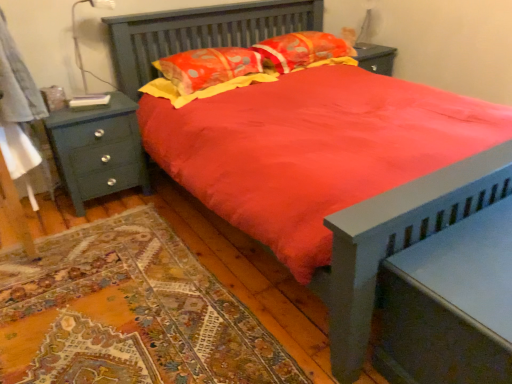
Question: Considering the relative sizes of metallic gray table lamp at upper left and floral fabric pillow at upper center, which is the 1th pillow in right-to-left order, in the image provided, is metallic gray table lamp at upper left bigger than floral fabric pillow at upper center, which is the 1th pillow in right-to-left order,?

Choices:
 (A) no
 (B) yes

Answer: (A)

Question: Is metallic gray table lamp at upper left far away from floral fabric pillow at upper center, which is the second pillow from left to right?

Choices:
 (A) yes
 (B) no

Answer: (A)

Question: Does metallic gray table lamp at upper left appear on the right side of floral fabric pillow at upper center, which is the 1th pillow in right-to-left order?

Choices:
 (A) no
 (B) yes

Answer: (A)

Question: Can you confirm if metallic gray table lamp at upper left is thinner than floral fabric pillow at upper center, which is the 1th pillow in right-to-left order?

Choices:
 (A) no
 (B) yes

Answer: (B)

Question: Is metallic gray table lamp at upper left completely or partially outside of floral fabric pillow at upper center, which is the second pillow from left to right?

Choices:
 (A) yes
 (B) no

Answer: (A)

Question: Can you confirm if metallic gray table lamp at upper left is taller than floral fabric pillow at upper center, which is the second pillow from left to right?

Choices:
 (A) yes
 (B) no

Answer: (A)

Question: Is teal wood nightstand at left, which appears as the first nightstand when viewed from the top, thinner than quilted orange pillow at center, positioned as the first pillow in left-to-right order?

Choices:
 (A) no
 (B) yes

Answer: (B)

Question: Considering the relative sizes of teal wood nightstand at left, which appears as the first nightstand when viewed from the top, and quilted orange pillow at center, positioned as the first pillow in left-to-right order, in the image provided, is teal wood nightstand at left, which appears as the first nightstand when viewed from the top, wider than quilted orange pillow at center, positioned as the first pillow in left-to-right order,?

Choices:
 (A) yes
 (B) no

Answer: (B)

Question: Does teal wood nightstand at left, arranged as the 2th nightstand when viewed from the right, have a greater height compared to quilted orange pillow at center, positioned as the first pillow in left-to-right order?

Choices:
 (A) yes
 (B) no

Answer: (A)

Question: Is teal wood nightstand at left, arranged as the 2th nightstand when viewed from the right, not near quilted orange pillow at center, positioned as the first pillow in left-to-right order?

Choices:
 (A) yes
 (B) no

Answer: (B)

Question: Does teal wood nightstand at left, positioned as the first nightstand in left-to-right order, appear on the right side of quilted orange pillow at center, positioned as the first pillow in left-to-right order?

Choices:
 (A) no
 (B) yes

Answer: (A)

Question: Is teal wood nightstand at left, positioned as the first nightstand in left-to-right order, positioned behind quilted orange pillow at center, positioned as the first pillow in left-to-right order?

Choices:
 (A) no
 (B) yes

Answer: (A)

Question: Is teal wood nightstand at left, positioned as the first nightstand in left-to-right order, to the right of matte gray nightstand at lower right, marked as the first nightstand in a front-to-back arrangement, from the viewer's perspective?

Choices:
 (A) no
 (B) yes

Answer: (A)